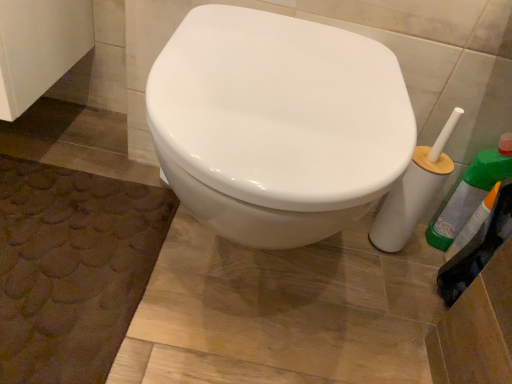
Question: Considering the positions of green plastic bottle at right and brown textured bath mat at lower left in the image, is green plastic bottle at right wider or thinner than brown textured bath mat at lower left?

Choices:
 (A) thin
 (B) wide

Answer: (A)

Question: Is point (454, 236) positioned closer to the camera than point (144, 256)?

Choices:
 (A) closer
 (B) farther

Answer: (B)

Question: Considering the positions of green plastic bottle at right and brown textured bath mat at lower left in the image, is green plastic bottle at right bigger or smaller than brown textured bath mat at lower left?

Choices:
 (A) small
 (B) big

Answer: (A)

Question: Visually, is brown textured bath mat at lower left positioned to the left or to the right of green plastic bottle at right?

Choices:
 (A) left
 (B) right

Answer: (A)

Question: Is brown textured bath mat at lower left bigger or smaller than green plastic bottle at right?

Choices:
 (A) big
 (B) small

Answer: (A)

Question: Considering their positions, is brown textured bath mat at lower left located in front of or behind green plastic bottle at right?

Choices:
 (A) front
 (B) behind

Answer: (A)

Question: From a real-world perspective, is brown textured bath mat at lower left physically located above or below green plastic bottle at right?

Choices:
 (A) above
 (B) below

Answer: (B)